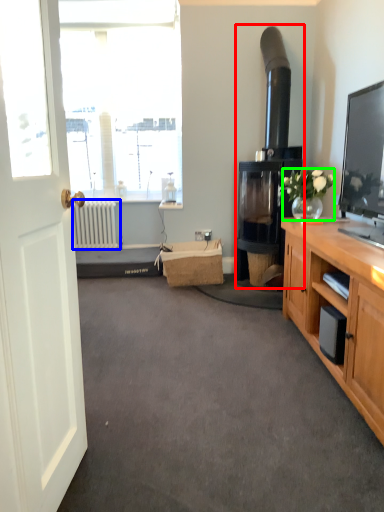
Question: Which object is positioned farthest from fireplace (highlighted by a red box)? Select from radiator (highlighted by a blue box) and houseplant (highlighted by a green box).

Choices:
 (A) radiator
 (B) houseplant

Answer: (A)